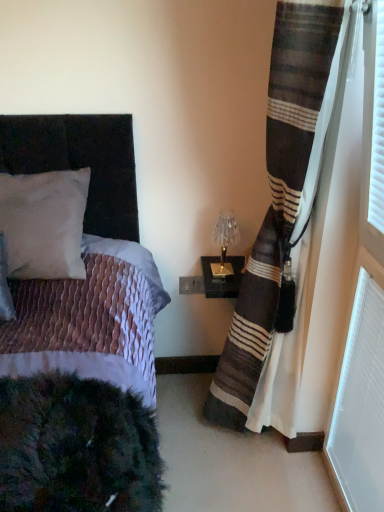
Question: Considering the positions of white textured radiator at lower right and white matte pillow at upper left in the image, is white textured radiator at lower right bigger or smaller than white matte pillow at upper left?

Choices:
 (A) big
 (B) small

Answer: (B)

Question: From the image's perspective, is white textured radiator at lower right positioned above or below white matte pillow at upper left?

Choices:
 (A) above
 (B) below

Answer: (B)

Question: Based on their relative distances, which object is farther from the velvet black bed at left?

Choices:
 (A) white textured radiator at lower right
 (B) striped fabric curtain at right
 (C) gold metallic table lamp at upper right
 (D) white matte pillow at upper left

Answer: (A)

Question: Considering the real-world distances, which object is closest to the velvet black bed at left?

Choices:
 (A) white matte pillow at upper left
 (B) striped fabric curtain at right
 (C) white textured radiator at lower right
 (D) gold metallic table lamp at upper right

Answer: (A)